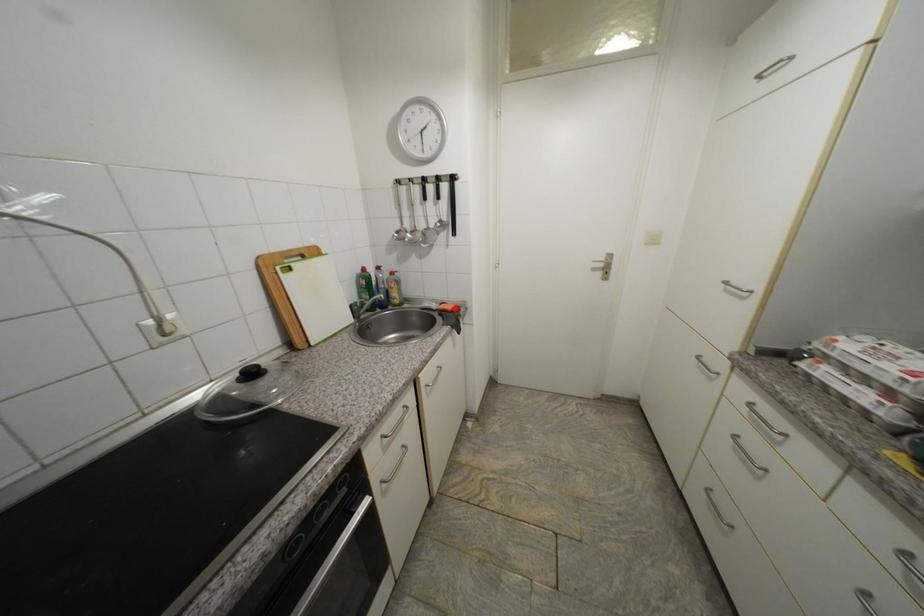
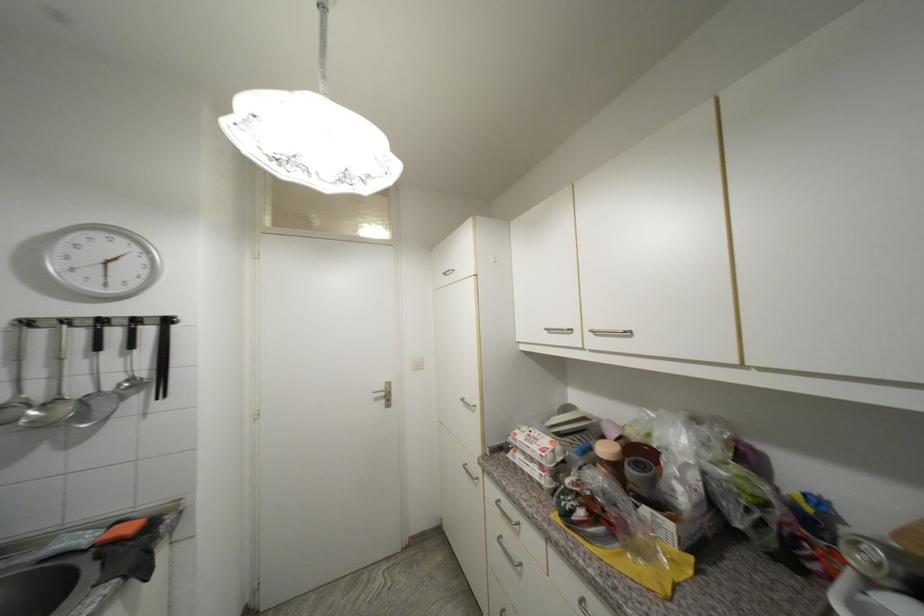
In the second image, find the point that corresponds to the highlighted location in the first image.

(137, 530)